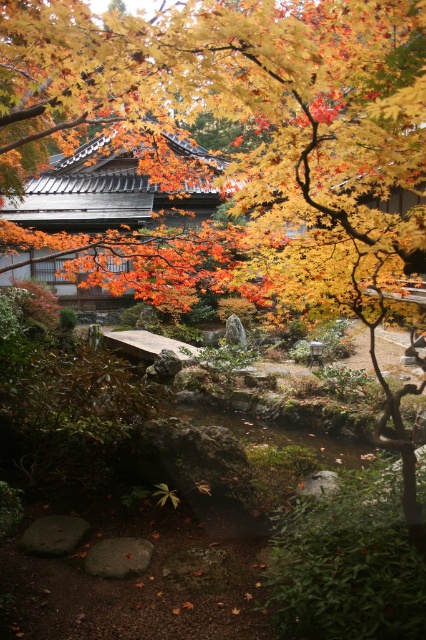
Between golden textured leaves at upper center and smooth stone bridge at center, which one has more height?

With more height is golden textured leaves at upper center.

Describe the element at coordinates (236, 136) in the screenshot. I see `golden textured leaves at upper center` at that location.

At what (x,y) coordinates should I click in order to perform the action: click on golden textured leaves at upper center. Please return your answer as a coordinate pair (x, y). Looking at the image, I should click on (236, 136).